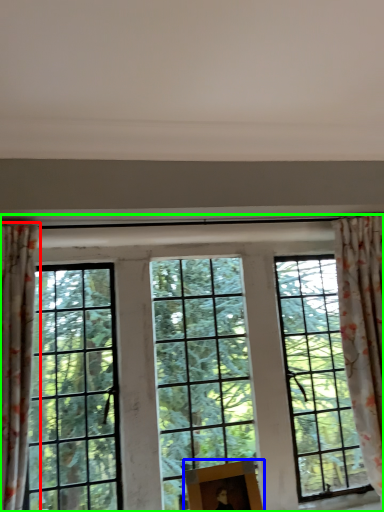
Question: Which object is the closest to the curtain (highlighted by a red box)? Choose among these: picture frame (highlighted by a blue box) or window (highlighted by a green box).

Choices:
 (A) picture frame
 (B) window

Answer: (B)